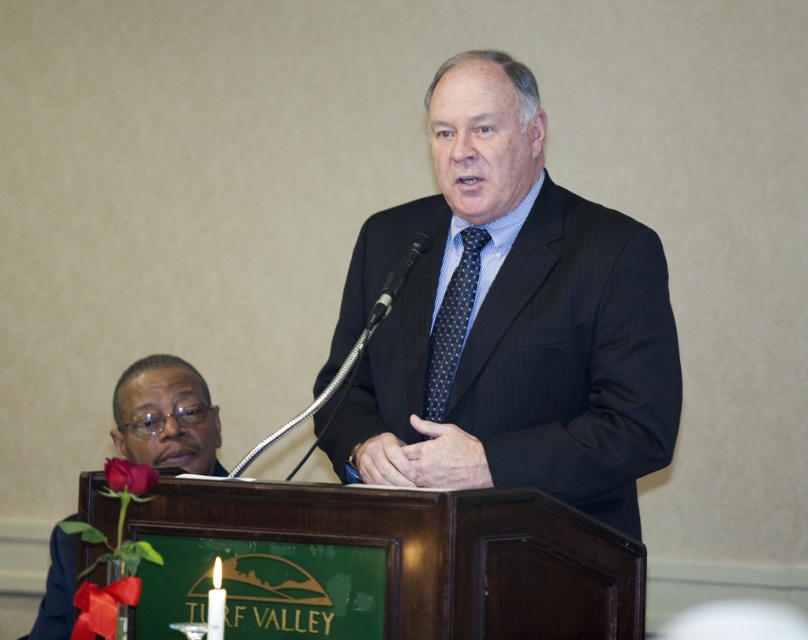
You are an event organizer who needs to ensure that the dark pinstripe suit at center and the black metallic microphone at center are visible in the photo. Which item should you adjust the camera focus on first to ensure both are in frame?

The dark pinstripe suit at center has a larger width than the black metallic microphone at center, so you should adjust the camera focus on the dark pinstripe suit at center first to ensure both are in frame.

You are a photographer at the event and need to position yourself so that both the dark pinstripe suit at center and the matte black suit at lower left are visible in your shot. Based on their positions, which side should you stand relative to the speaker to capture both?

You should stand to the left of the speaker because the dark pinstripe suit at center is to the right of the matte black suit at lower left, so positioning yourself to the left would allow you to see both suits in the frame.

You are organizing a charity event and have two suits to choose from. The dark pinstripe suit at center and the matte black suit at lower left. Which one would be more appropriate for a formal event?

The dark pinstripe suit at center is bigger than the matte black suit at lower left, so it would be more appropriate for a formal event as it commands more presence.